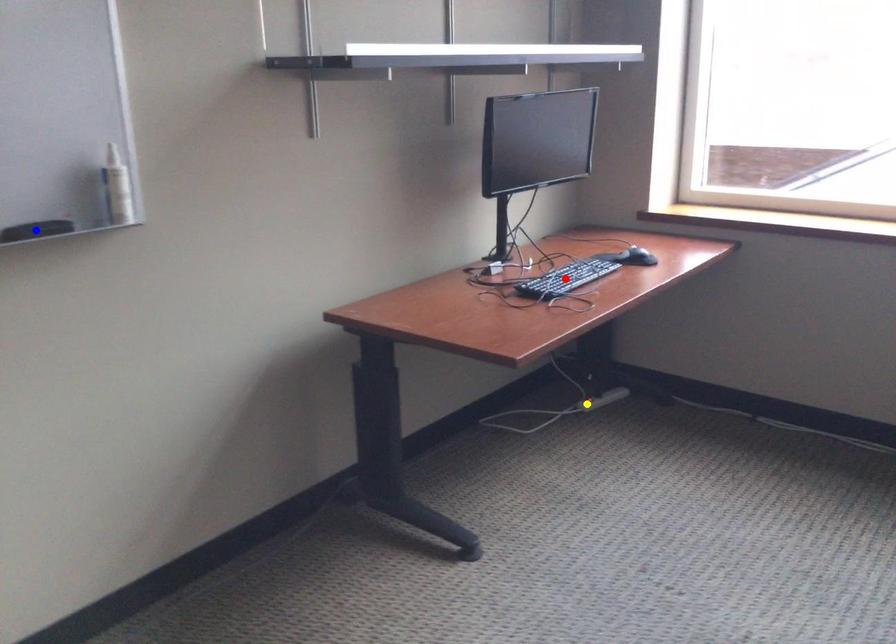
Order these from nearest to farthest:
1. red point
2. yellow point
3. blue point

blue point → red point → yellow point